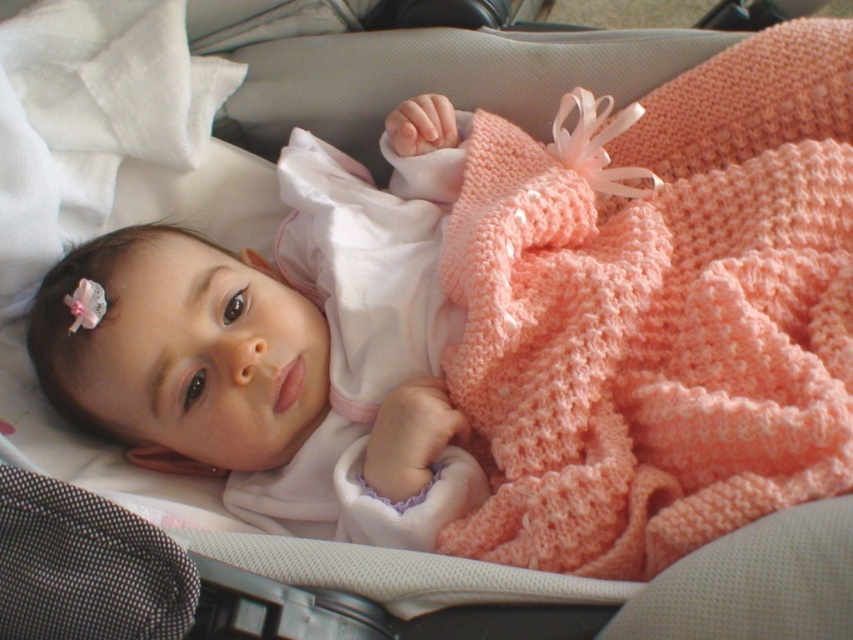
Question: Can you confirm if peach knitted blanket at center is thinner than matte white baby at center?

Choices:
 (A) no
 (B) yes

Answer: (B)

Question: Which point is farther to the camera?

Choices:
 (A) (614, 561)
 (B) (207, 371)

Answer: (B)

Question: Which point is closer to the camera?

Choices:
 (A) matte white baby at center
 (B) peach knitted blanket at center

Answer: (B)

Question: Among these points, which one is nearest to the camera?

Choices:
 (A) (412, 237)
 (B) (619, 531)

Answer: (B)

Question: In this image, where is peach knitted blanket at center located relative to matte white baby at center?

Choices:
 (A) above
 (B) below

Answer: (A)

Question: From the image, what is the correct spatial relationship of peach knitted blanket at center in relation to matte white baby at center?

Choices:
 (A) right
 (B) left

Answer: (A)